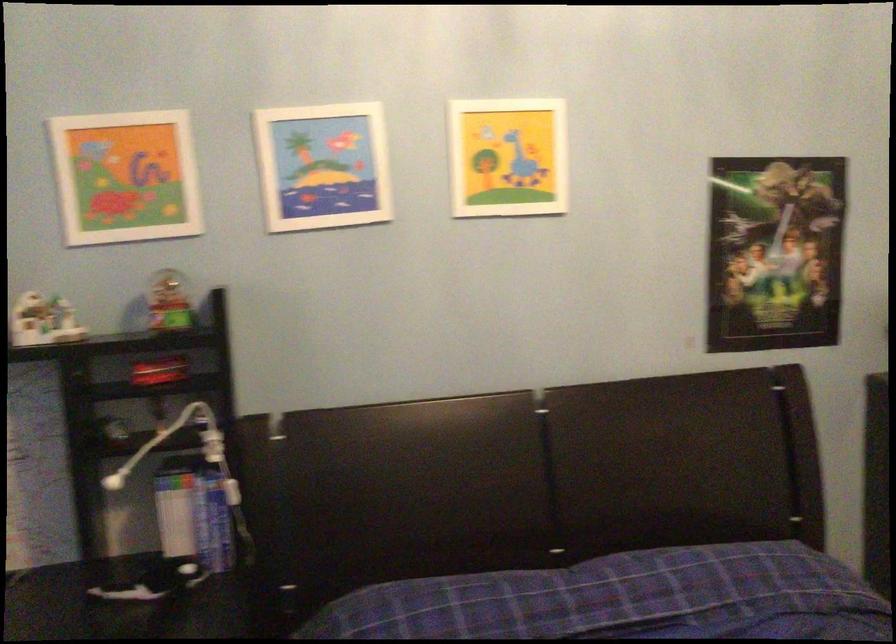
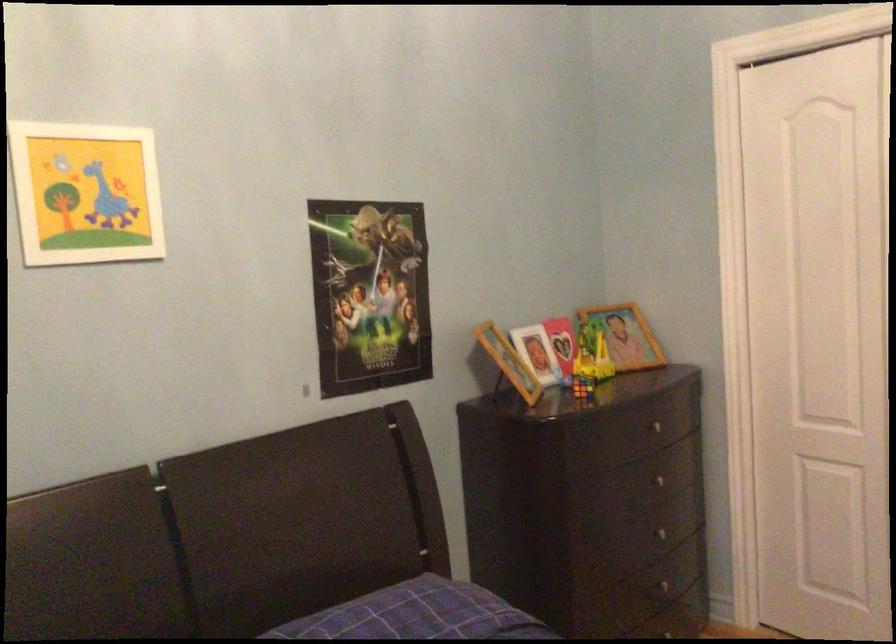
Where in the second image is the point corresponding to point (510, 156) from the first image?

(85, 193)